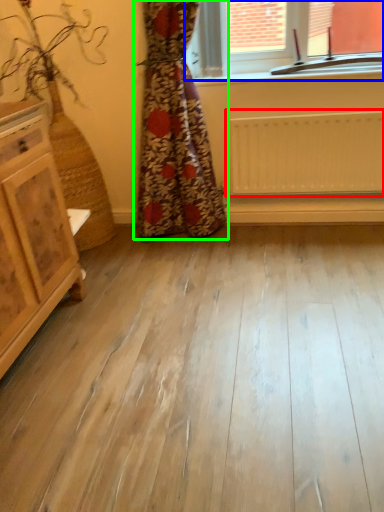
Question: Which is farther away from radiator (highlighted by a red box)? window (highlighted by a blue box) or curtain (highlighted by a green box)?

Choices:
 (A) window
 (B) curtain

Answer: (A)